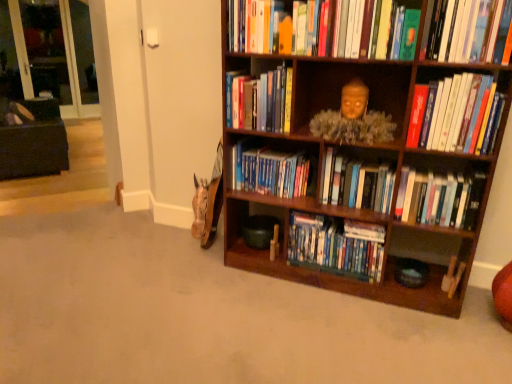
Image resolution: width=512 pixels, height=384 pixels. Describe the element at coordinates (79, 60) in the screenshot. I see `transparent glass door at upper left, marked as the second glass door in a left-to-right arrangement` at that location.

The height and width of the screenshot is (384, 512). What do you see at coordinates (269, 172) in the screenshot?
I see `blue hardcover books at center, placed as the 4th book when sorted from top to bottom` at bounding box center [269, 172].

In order to face hardcover book at upper right, which is counted as the 1th book, starting from the top, should I rotate leftwards or rightwards?

Turn right by 26.504 degrees to look at hardcover book at upper right, which is counted as the 1th book, starting from the top.

What do you see at coordinates (439, 198) in the screenshot?
I see `hardcover books at center right, the sixth book positioned from the top` at bounding box center [439, 198].

Locate an element on the screen. The image size is (512, 384). hardcover books at upper right, which appears as the 3th book when viewed from the top is located at coordinates (456, 114).

I want to click on transparent glass door at upper left, the 1th glass door from the left, so click(x=53, y=53).

At what (x,y) coordinates should I click in order to perform the action: click on transparent glass door at upper left, the 1th glass door when ordered from right to left. Please return your answer as a coordinate pair (x, y). Image resolution: width=512 pixels, height=384 pixels. Looking at the image, I should click on (79, 60).

Is hardcover books at center right, which appears as the second book when ordered from the bottom, in contact with hardcover book at upper right, the seventh book ordered from the bottom?

No, hardcover books at center right, which appears as the second book when ordered from the bottom, is not with hardcover book at upper right, the seventh book ordered from the bottom.

Where is `the 2nd book in front when counting from the hardcover books at center right, which appears as the second book when ordered from the bottom`? The image size is (512, 384). the 2nd book in front when counting from the hardcover books at center right, which appears as the second book when ordered from the bottom is located at coordinates (468, 31).

Is hardcover books at center right, which appears as the second book when ordered from the bottom, looking in the opposite direction of hardcover book at upper right, the seventh book ordered from the bottom?

No, hardcover books at center right, which appears as the second book when ordered from the bottom,'s orientation is not away from hardcover book at upper right, the seventh book ordered from the bottom.

Considering the relative positions of hardcover books at center right, which appears as the second book when ordered from the bottom, and hardcover book at upper right, the seventh book ordered from the bottom, in the image provided, is hardcover books at center right, which appears as the second book when ordered from the bottom, in front of hardcover book at upper right, the seventh book ordered from the bottom,?

No.

Which object is wider, hardcover book at upper right, which is counted as the 1th book, starting from the top, or wooden bookshelf at center, the 1th book ordered from the bottom?

hardcover book at upper right, which is counted as the 1th book, starting from the top, is wider.

What's the angular difference between hardcover book at upper right, the seventh book ordered from the bottom, and wooden bookshelf at center, the seventh book viewed from the top,'s facing directions?

1.57 degrees separate the facing orientations of hardcover book at upper right, the seventh book ordered from the bottom, and wooden bookshelf at center, the seventh book viewed from the top.

Considering the relative sizes of hardcover book at upper right, which is counted as the 1th book, starting from the top, and wooden bookshelf at center, the 1th book ordered from the bottom, in the image provided, is hardcover book at upper right, which is counted as the 1th book, starting from the top, taller than wooden bookshelf at center, the 1th book ordered from the bottom,?

No.

Which is farther, (60,166) or (295,176)?

The point (60,166) is farther.

Which is behind, dark brown fabric bean bag chair at left or blue hardcover books at center, arranged as the 4th book when ordered from the bottom?

dark brown fabric bean bag chair at left is more distant.

From the image's perspective, is dark brown fabric bean bag chair at left positioned above or below blue hardcover books at center, arranged as the 4th book when ordered from the bottom?

From the image's perspective, dark brown fabric bean bag chair at left appears above blue hardcover books at center, arranged as the 4th book when ordered from the bottom.

Is dark brown fabric bean bag chair at left oriented towards blue hardcover books at center, placed as the 4th book when sorted from top to bottom?

No, dark brown fabric bean bag chair at left is not facing towards blue hardcover books at center, placed as the 4th book when sorted from top to bottom.

Where is `the 1st glass door located above the wooden bookshelf at center, the 1th book ordered from the bottom (from a real-world perspective)`? The image size is (512, 384). the 1st glass door located above the wooden bookshelf at center, the 1th book ordered from the bottom (from a real-world perspective) is located at coordinates (79, 60).

From their relative heights in the image, would you say wooden bookshelf at center, the 1th book ordered from the bottom, is taller or shorter than transparent glass door at upper left, marked as the second glass door in a left-to-right arrangement?

In the image, wooden bookshelf at center, the 1th book ordered from the bottom, appears to be shorter than transparent glass door at upper left, marked as the second glass door in a left-to-right arrangement.

Considering the sizes of objects wooden bookshelf at center, the 1th book ordered from the bottom, and transparent glass door at upper left, the 1th glass door when ordered from right to left, in the image provided, who is thinner, wooden bookshelf at center, the 1th book ordered from the bottom, or transparent glass door at upper left, the 1th glass door when ordered from right to left,?

With smaller width is transparent glass door at upper left, the 1th glass door when ordered from right to left.

Which is correct: wooden bookshelf at center, the seventh book viewed from the top, is inside transparent glass door at upper left, marked as the second glass door in a left-to-right arrangement, or outside of it?

wooden bookshelf at center, the seventh book viewed from the top, cannot be found inside transparent glass door at upper left, marked as the second glass door in a left-to-right arrangement.

From the image's perspective, is transparent glass door at upper left, marked as the second glass door in a left-to-right arrangement, over hardcover books at center, which is the third book from bottom to top?

Yes.

Is transparent glass door at upper left, the 1th glass door when ordered from right to left, in front of hardcover books at center, the 5th book viewed from the top?

No, transparent glass door at upper left, the 1th glass door when ordered from right to left, is behind hardcover books at center, the 5th book viewed from the top.

Could hardcover books at center, the 5th book viewed from the top, be considered to be inside transparent glass door at upper left, the 1th glass door when ordered from right to left?

No, hardcover books at center, the 5th book viewed from the top, is not surrounded by transparent glass door at upper left, the 1th glass door when ordered from right to left.

Where is `person in front of the dark brown fabric bean bag chair at left`? The width and height of the screenshot is (512, 384). person in front of the dark brown fabric bean bag chair at left is located at coordinates (353, 119).

Is wooden statue at upper center placed right next to dark brown fabric bean bag chair at left?

No.

Does wooden statue at upper center turn towards dark brown fabric bean bag chair at left?

No, wooden statue at upper center is not facing towards dark brown fabric bean bag chair at left.

From a real-world perspective, which object rests below the other?

wooden statue at upper center, from a real-world perspective.

Where is `book that is the 4th one when counting rightward from the wooden statue at upper center`? book that is the 4th one when counting rightward from the wooden statue at upper center is located at coordinates (468, 31).

Are hardcover book at upper right, which is counted as the 1th book, starting from the top, and wooden statue at upper center making contact?

No, hardcover book at upper right, which is counted as the 1th book, starting from the top, is not with wooden statue at upper center.

Who is smaller, hardcover book at upper right, the seventh book ordered from the bottom, or wooden statue at upper center?

hardcover book at upper right, the seventh book ordered from the bottom, is smaller.

From a real-world perspective, which book is the 5th one underneath the hardcover book at upper right, which is counted as the 1th book, starting from the top? Please provide its 2D coordinates.

[(439, 198)]

Identify the location of the 5th book behind when counting from the hardcover book at upper right, which is counted as the 1th book, starting from the top. (337, 246).

Estimate the real-world distances between objects in this image. Which object is further from wooden statue at upper center, hardcover books at center right, the sixth book positioned from the top, or wooden bookcase at right?

Based on the image, hardcover books at center right, the sixth book positioned from the top, appears to be further to wooden statue at upper center.

When comparing their distances from hardcover books at center, which is counted as the 6th book, starting from the bottom, does hardcover book at upper right, the seventh book ordered from the bottom, or hardcover books at center right, which appears as the second book when ordered from the bottom, seem closer?

hardcover book at upper right, the seventh book ordered from the bottom, lies closer to hardcover books at center, which is counted as the 6th book, starting from the bottom, than the other object.

Looking at the image, which one is located closer to wooden statue at upper center, transparent glass door at upper left, the 1th glass door when ordered from right to left, or blue hardcover books at center, placed as the 4th book when sorted from top to bottom?

Among the two, blue hardcover books at center, placed as the 4th book when sorted from top to bottom, is located nearer to wooden statue at upper center.

From the image, which object appears to be farther from transparent glass door at upper left, the 1th glass door from the left, hardcover books at upper right, the fifth book when ordered from bottom to top, or hardcover books at center, which is counted as the 6th book, starting from the bottom?

The object further to transparent glass door at upper left, the 1th glass door from the left, is hardcover books at upper right, the fifth book when ordered from bottom to top.

From the image, which object appears to be nearer to transparent glass door at upper left, marked as the second glass door in a left-to-right arrangement, hardcover books at center right, the sixth book positioned from the top, or hardcover books at upper right, the fifth book when ordered from bottom to top?

Among the two, hardcover books at center right, the sixth book positioned from the top, is located nearer to transparent glass door at upper left, marked as the second glass door in a left-to-right arrangement.

Estimate the real-world distances between objects in this image. Which object is closer to wooden bookcase at right, hardcover books at center, the 5th book viewed from the top, or transparent glass door at upper left, the 1th glass door from the left?

hardcover books at center, the 5th book viewed from the top, is positioned closer to the anchor wooden bookcase at right.

Looking at this image, estimate the real-world distances between objects in this image. Which object is further from hardcover books at upper right, the fifth book when ordered from bottom to top, hardcover book at upper right, which is counted as the 1th book, starting from the top, or dark brown fabric bean bag chair at left?

Among the two, dark brown fabric bean bag chair at left is located further to hardcover books at upper right, the fifth book when ordered from bottom to top.

Which object lies further to the anchor point wooden bookshelf at center, the seventh book viewed from the top, wooden statue at upper center or wooden bookcase at right?

wooden statue at upper center lies further to wooden bookshelf at center, the seventh book viewed from the top, than the other object.

Where is `person between blue hardcover books at center, arranged as the 4th book when ordered from the bottom, and hardcover books at center right, which appears as the second book when ordered from the bottom, from left to right`? person between blue hardcover books at center, arranged as the 4th book when ordered from the bottom, and hardcover books at center right, which appears as the second book when ordered from the bottom, from left to right is located at coordinates (353, 119).

The height and width of the screenshot is (384, 512). Identify the location of glass door positioned between wooden bookcase at right and transparent glass door at upper left, the 1th glass door when ordered from right to left, from near to far. (53, 53).

Where is `bean bag chair between hardcover books at center, the 5th book viewed from the top, and transparent glass door at upper left, the 1th glass door when ordered from right to left, in the front-back direction`? bean bag chair between hardcover books at center, the 5th book viewed from the top, and transparent glass door at upper left, the 1th glass door when ordered from right to left, in the front-back direction is located at coordinates (32, 139).

Locate an element on the screen. bean bag chair between hardcover books at upper right, the fifth book when ordered from bottom to top, and transparent glass door at upper left, the 1th glass door from the left, from front to back is located at coordinates (32, 139).